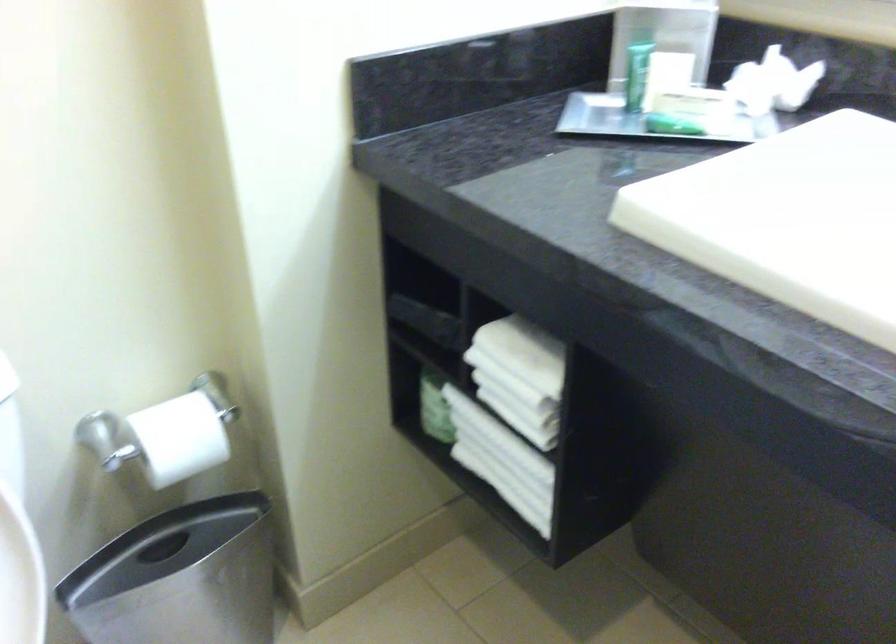
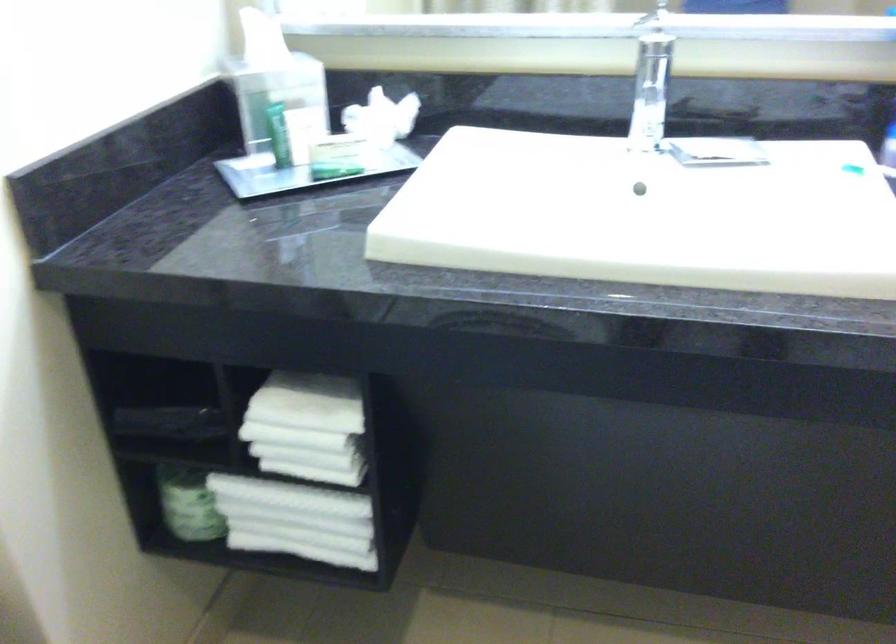
In the second image, find the point that corresponds to (x=677, y=115) in the first image.

(337, 160)